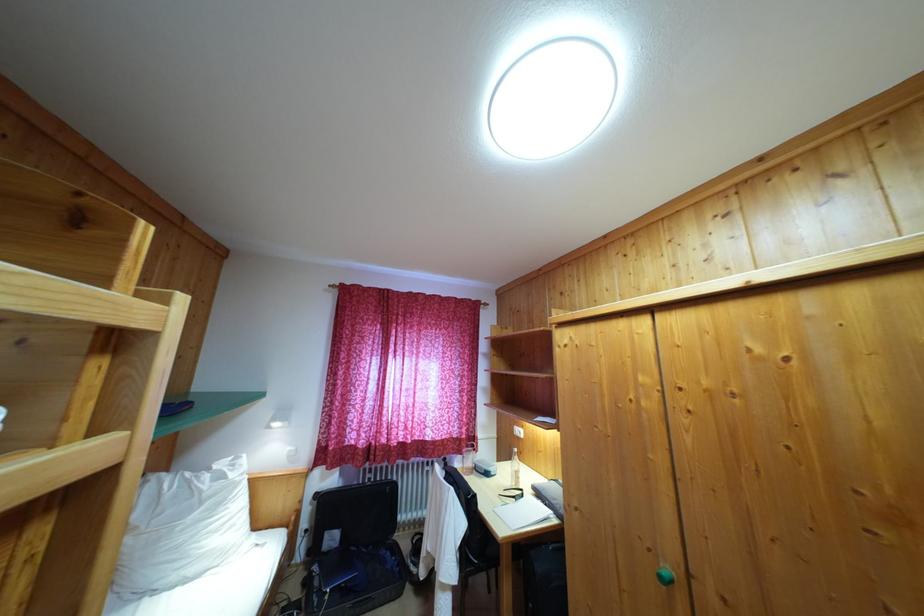
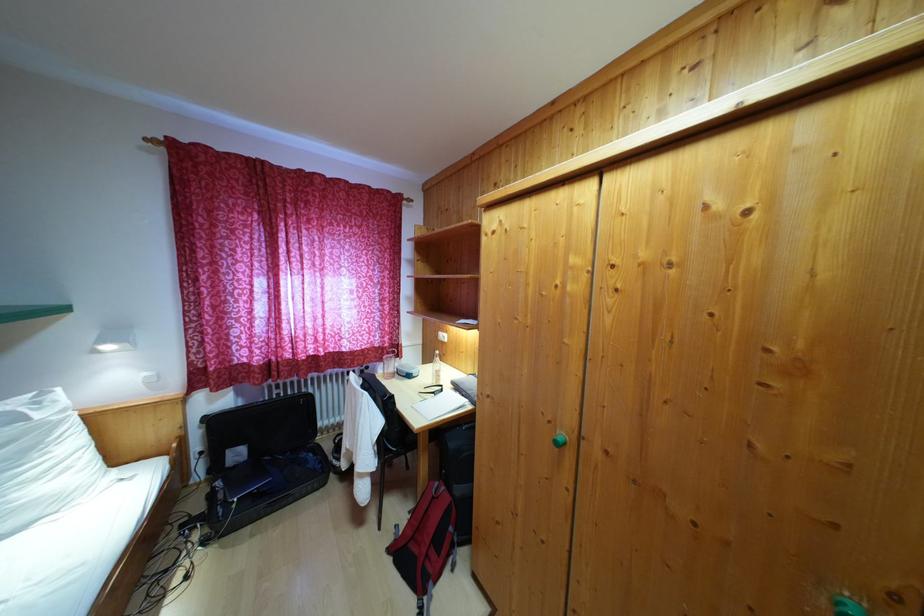
What movement of the cameraman would produce the second image?

The movement direction of the cameraman is right, forward.